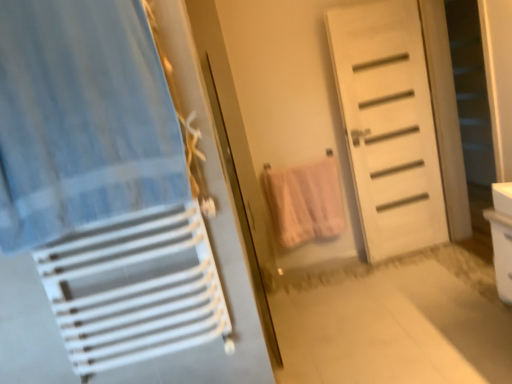
Question: From a real-world perspective, is white matte screen door at right located beneath blue striped fabric at left?

Choices:
 (A) no
 (B) yes

Answer: (B)

Question: Considering the relative positions of white matte screen door at right and blue striped fabric at left in the image provided, is white matte screen door at right to the right of blue striped fabric at left from the viewer's perspective?

Choices:
 (A) no
 (B) yes

Answer: (B)

Question: Considering the relative sizes of white matte screen door at right and blue striped fabric at left in the image provided, is white matte screen door at right wider than blue striped fabric at left?

Choices:
 (A) no
 (B) yes

Answer: (A)

Question: Is white matte screen door at right taller than blue striped fabric at left?

Choices:
 (A) yes
 (B) no

Answer: (A)

Question: Can we say white matte screen door at right lies outside blue striped fabric at left?

Choices:
 (A) no
 (B) yes

Answer: (B)

Question: From a real-world perspective, is white matte screen door at right on blue striped fabric at left?

Choices:
 (A) yes
 (B) no

Answer: (B)

Question: Can we say pink cotton towel at center lies outside white matte screen door at right?

Choices:
 (A) no
 (B) yes

Answer: (B)

Question: Is pink cotton towel at center looking in the opposite direction of white matte screen door at right?

Choices:
 (A) no
 (B) yes

Answer: (A)

Question: Is pink cotton towel at center wider than white matte screen door at right?

Choices:
 (A) yes
 (B) no

Answer: (A)

Question: Is pink cotton towel at center to the right of white matte screen door at right from the viewer's perspective?

Choices:
 (A) yes
 (B) no

Answer: (B)

Question: Considering the relative sizes of pink cotton towel at center and white matte screen door at right in the image provided, is pink cotton towel at center smaller than white matte screen door at right?

Choices:
 (A) no
 (B) yes

Answer: (A)

Question: Is pink cotton towel at center positioned far away from white matte screen door at right?

Choices:
 (A) no
 (B) yes

Answer: (B)

Question: Can you confirm if white matte door at center is shorter than pink cotton towel at center?

Choices:
 (A) yes
 (B) no

Answer: (B)